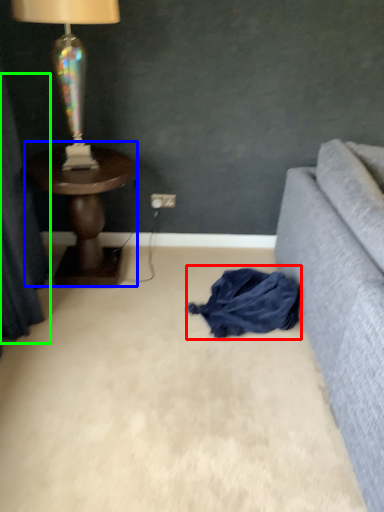
Question: Which object is positioned farthest from clothing (highlighted by a red box)? Select from table (highlighted by a blue box) and curtain (highlighted by a green box).

Choices:
 (A) table
 (B) curtain

Answer: (B)